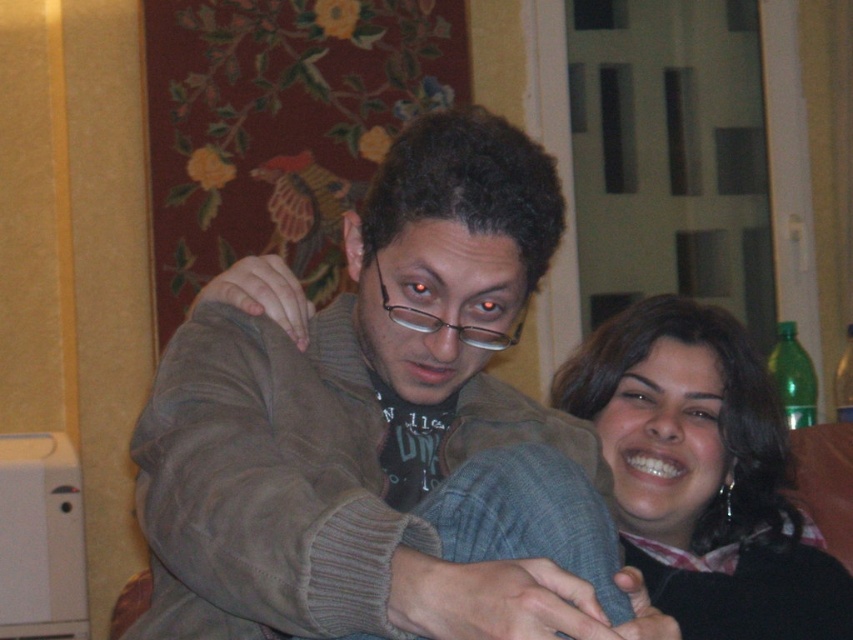
You are a photographer setting up for a portrait. You want to ensure that both the brown suede jacket at center and the black matte hair at upper right are in focus. The depth of field you can achieve with your current camera settings allows objects within 50 centimeters of each other to be in focus. Will both subjects be in focus?

The distance between the brown suede jacket at center and the black matte hair at upper right is 53.84 centimeters. Since this exceeds the 50 centimeter depth of field range, both subjects may not be in focus simultaneously with the current settings.

You are a photographer adjusting your camera settings to capture the scene. You need to ensure both the brown suede jacket at center and the black matte hair at upper right are in focus. Which object should you prioritize focusing on first to ensure depth of field covers both?

The brown suede jacket at center is bigger than the black matte hair at upper right, so focusing on the larger object first will help ensure both are in focus.